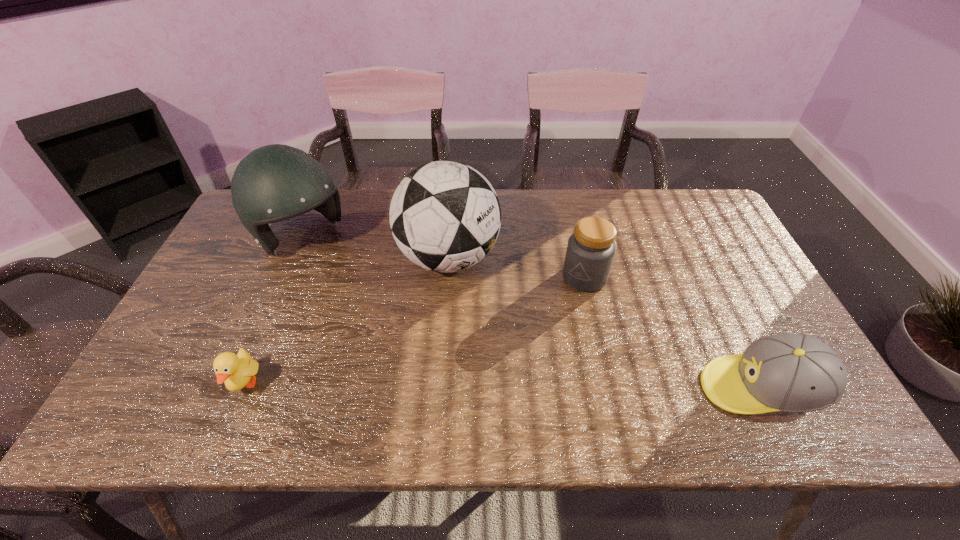
At what (x,y) coordinates should I click in order to perform the action: click on soccer ball positioned at the far edge. Please return your answer as a coordinate pair (x, y). Looking at the image, I should click on (445, 216).

Locate an element on the screen. duckling at the near edge is located at coordinates (237, 371).

I want to click on baseball cap that is positioned at the near edge, so click(x=788, y=372).

Locate an element on the screen. The width and height of the screenshot is (960, 540). object at the left edge is located at coordinates (276, 182).

I want to click on object located in the right edge section of the desktop, so click(788, 372).

Where is `object that is at the far left corner`? This screenshot has height=540, width=960. object that is at the far left corner is located at coordinates click(x=276, y=182).

Locate an element on the screen. This screenshot has width=960, height=540. object that is at the near right corner is located at coordinates [788, 372].

Locate an element on the screen. The image size is (960, 540). free space at the far edge of the desktop is located at coordinates (362, 212).

Find the location of `vacant space at the near edge of the desktop`. vacant space at the near edge of the desktop is located at coordinates tap(468, 362).

You are a GUI agent. You are given a task and a screenshot of the screen. Output one action in this format:
    pyautogui.click(x=<x>, y=<y>)
    Task: Click on the free location at the left edge
    The image size is (960, 540).
    Given the screenshot: What is the action you would take?
    pyautogui.click(x=239, y=330)